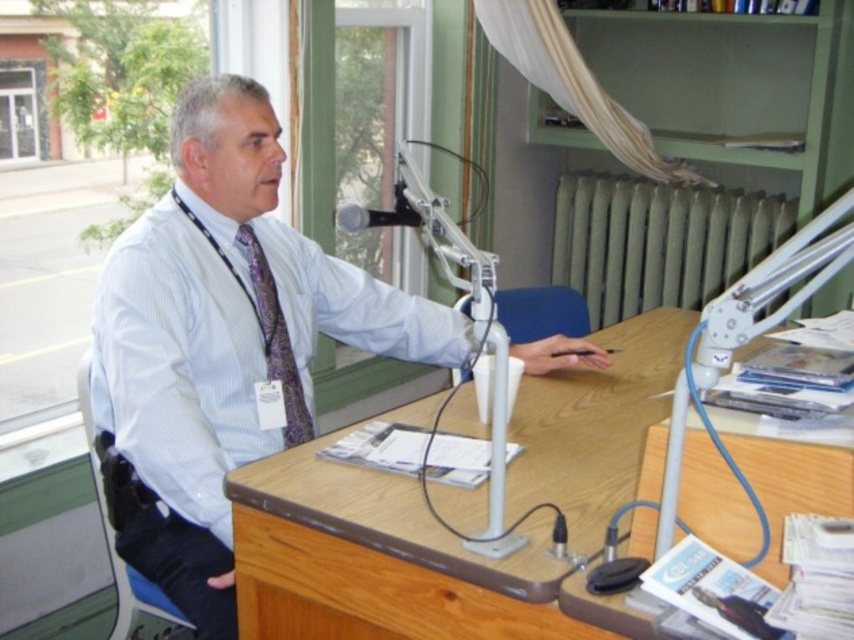
Question: Is wooden desk at center above black leather chair at left?

Choices:
 (A) yes
 (B) no

Answer: (A)

Question: Among these points, which one is nearest to the camera?

Choices:
 (A) (155, 312)
 (B) (227, 609)

Answer: (A)

Question: Does black leather chair at left lie in front of black matte microphone at upper center?

Choices:
 (A) no
 (B) yes

Answer: (A)

Question: Is white shirt at center closer to the viewer compared to purple paisley tie at center?

Choices:
 (A) no
 (B) yes

Answer: (B)

Question: Which of the following is the farthest from the observer?

Choices:
 (A) (513, 300)
 (B) (75, 380)

Answer: (A)

Question: Which object is the closest to the black matte microphone at upper center?

Choices:
 (A) white shirt at center
 (B) black leather chair at left

Answer: (A)